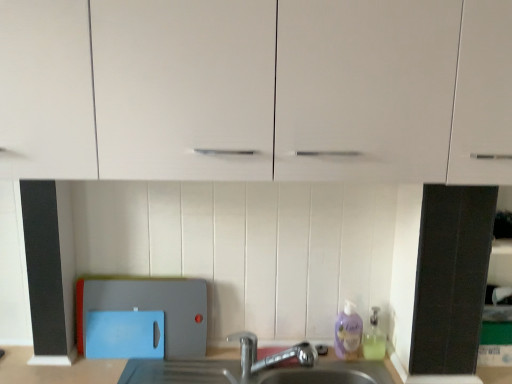
Question: Considering their positions, is purple translucent liquid soap at lower right, which is counted as the 1th cleaning product, starting from the left, located in front of or behind blue plastic cutting board at lower left?

Choices:
 (A) behind
 (B) front

Answer: (A)

Question: From the image's perspective, is purple translucent liquid soap at lower right, which is counted as the 1th cleaning product, starting from the left, located above or below blue plastic cutting board at lower left?

Choices:
 (A) above
 (B) below

Answer: (B)

Question: Which of these objects is positioned closest to the purple translucent liquid soap at lower right, which is counted as the 1th cleaning product, starting from the left?

Choices:
 (A) translucent plastic soap dispenser at lower right, which is counted as the 1th cleaning product, starting from the right
 (B) silver metallic faucet at lower center
 (C) white glossy cabinet at upper center
 (D) blue plastic cutting board at lower left

Answer: (A)

Question: Which of these objects is positioned farthest from the purple translucent liquid soap at lower right, which is counted as the 1th cleaning product, starting from the left?

Choices:
 (A) white glossy cabinet at upper center
 (B) silver metallic faucet at lower center
 (C) blue plastic cutting board at lower left
 (D) translucent plastic soap dispenser at lower right, which is counted as the 1th cleaning product, starting from the right

Answer: (A)